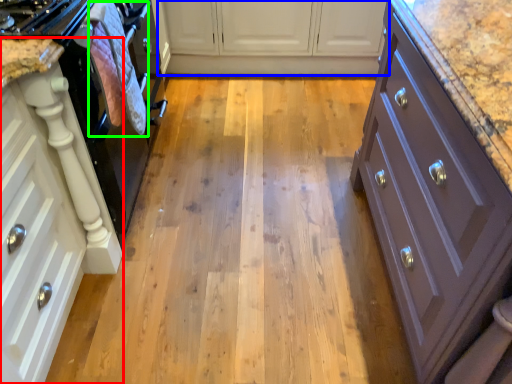
Question: Based on their relative distances, which object is nearer to cabinetry (highlighted by a red box)? Choose from cabinetry (highlighted by a blue box) and material (highlighted by a green box).

Choices:
 (A) cabinetry
 (B) material

Answer: (B)